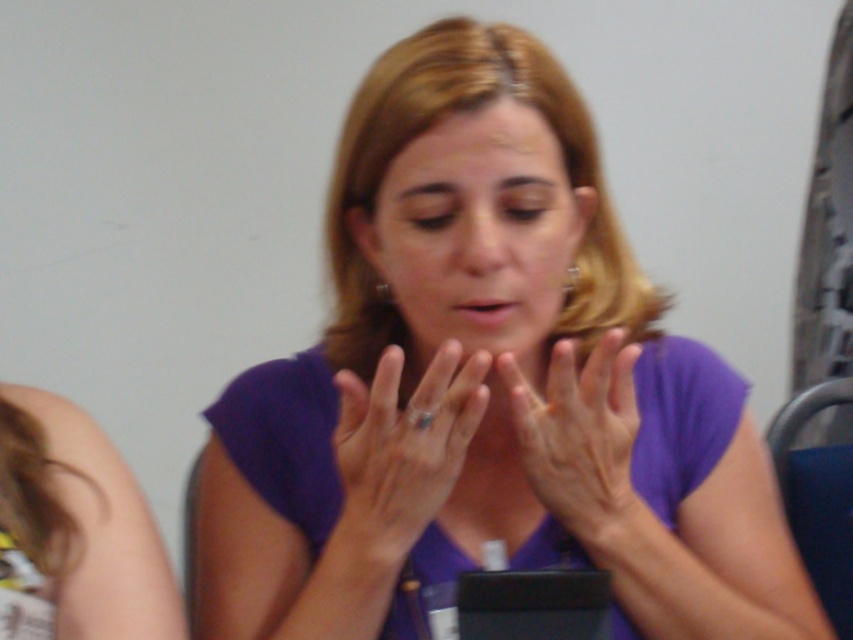
Question: Which object appears farthest from the camera in this image?

Choices:
 (A) dry skin hands at center
 (B) matte gold ring at center

Answer: (A)

Question: Is matte gold ring at center bigger than dry skin hands at center?

Choices:
 (A) yes
 (B) no

Answer: (B)

Question: Which object is farther from the camera taking this photo?

Choices:
 (A) purple matte shirt at center
 (B) purple matte face at center

Answer: (B)

Question: Which object is positioned farthest from the dry skin hands at center?

Choices:
 (A) matte gold ring at center
 (B) purple matte face at center

Answer: (B)

Question: From the image, what is the correct spatial relationship of purple matte shirt at center in relation to matte gold ring at center?

Choices:
 (A) below
 (B) above

Answer: (B)

Question: Does purple matte shirt at center have a lesser width compared to matte gold ring at center?

Choices:
 (A) yes
 (B) no

Answer: (B)